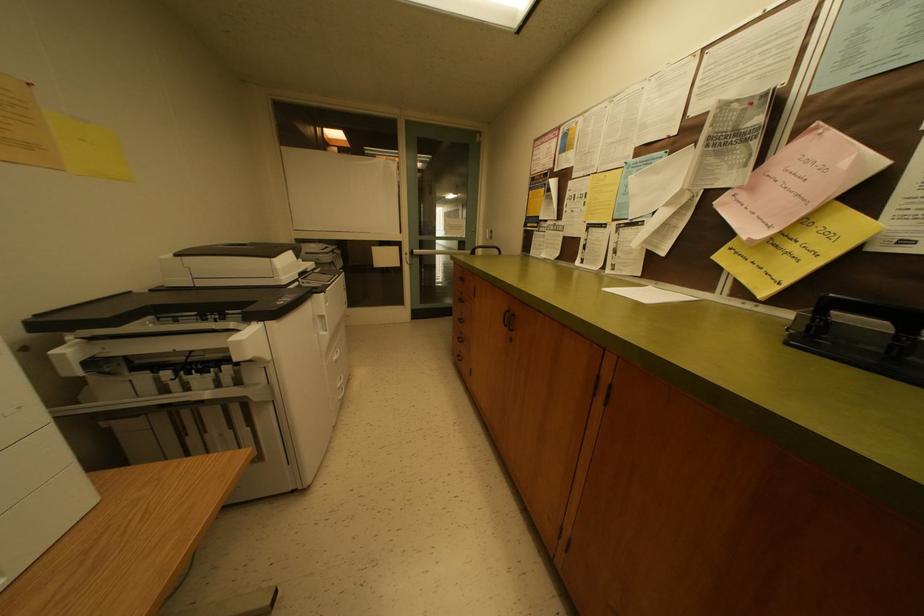
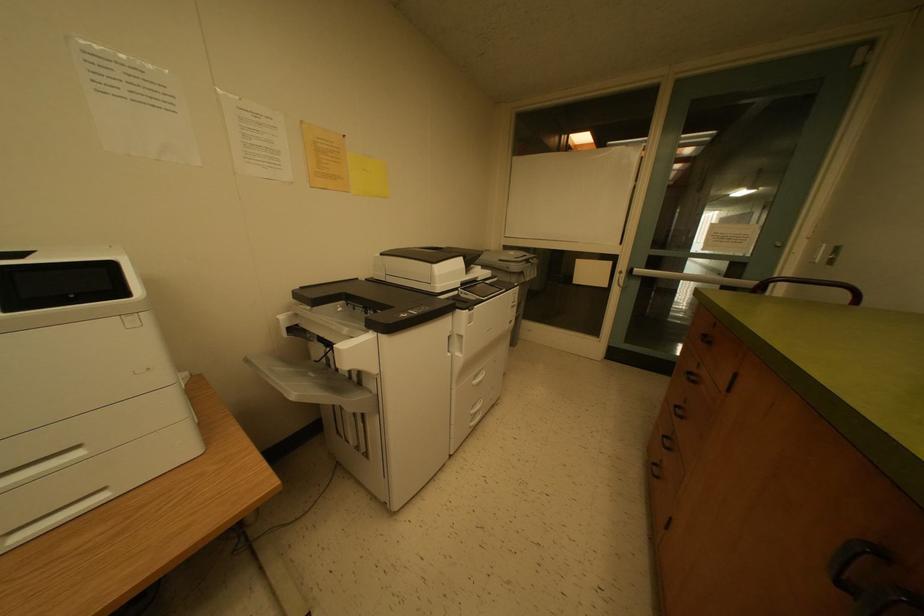
Question: The camera is either moving clockwise (left) or counter-clockwise (right) around the object. The first image is from the beginning of the video and the second image is from the end. Is the camera moving left or right when shooting the video?

Choices:
 (A) Left
 (B) Right

Answer: (B)